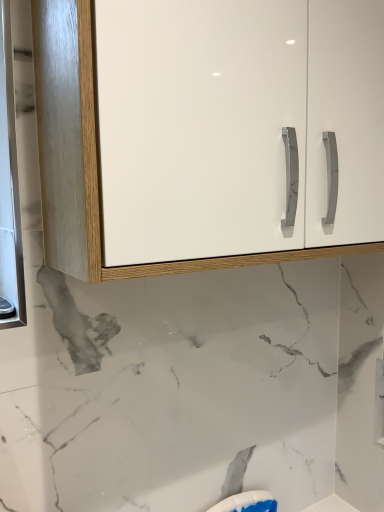
The image size is (384, 512). What are the coordinates of `white glossy medicine cabinet at left` in the screenshot? It's located at (9, 188).

In the scene shown: Measure the distance between white glossy medicine cabinet at left and camera.

white glossy medicine cabinet at left and camera are 28.22 inches apart.

Describe the element at coordinates (9, 188) in the screenshot. I see `white glossy medicine cabinet at left` at that location.

The height and width of the screenshot is (512, 384). Find the location of `white glossy cabinet at upper center`. white glossy cabinet at upper center is located at coordinates (208, 132).

This screenshot has height=512, width=384. What do you see at coordinates (208, 132) in the screenshot? I see `white glossy cabinet at upper center` at bounding box center [208, 132].

Find the location of `white glossy medicine cabinet at left`. white glossy medicine cabinet at left is located at coordinates (9, 188).

Can you confirm if white glossy medicine cabinet at left is positioned to the left of white glossy cabinet at upper center?

Correct, you'll find white glossy medicine cabinet at left to the left of white glossy cabinet at upper center.

In the image, is white glossy medicine cabinet at left positioned in front of or behind white glossy cabinet at upper center?

white glossy medicine cabinet at left is behind white glossy cabinet at upper center.

Does point (2, 263) come in front of point (138, 67)?

No, it is behind (138, 67).

From the image's perspective, is white glossy medicine cabinet at left over white glossy cabinet at upper center?

No.

From a real-world perspective, who is located higher, white glossy medicine cabinet at left or white glossy cabinet at upper center?

white glossy cabinet at upper center, from a real-world perspective.

Can you confirm if white glossy medicine cabinet at left is wider than white glossy cabinet at upper center?

In fact, white glossy medicine cabinet at left might be narrower than white glossy cabinet at upper center.

Considering the relative sizes of white glossy medicine cabinet at left and white glossy cabinet at upper center in the image provided, is white glossy medicine cabinet at left shorter than white glossy cabinet at upper center?

No.

Considering the relative sizes of white glossy medicine cabinet at left and white glossy cabinet at upper center in the image provided, is white glossy medicine cabinet at left smaller than white glossy cabinet at upper center?

Indeed, white glossy medicine cabinet at left has a smaller size compared to white glossy cabinet at upper center.

Is white glossy medicine cabinet at left surrounding white glossy cabinet at upper center?

No, white glossy cabinet at upper center is not a part of white glossy medicine cabinet at left.

Are white glossy medicine cabinet at left and white glossy cabinet at upper center beside each other?

No.

Is white glossy medicine cabinet at left facing towards white glossy cabinet at upper center?

No, white glossy medicine cabinet at left is not facing towards white glossy cabinet at upper center.

What's the angular difference between white glossy medicine cabinet at left and white glossy cabinet at upper center's facing directions?

The angle between the facing direction of white glossy medicine cabinet at left and the facing direction of white glossy cabinet at upper center is 93.5 degrees.

The width and height of the screenshot is (384, 512). What are the coordinates of `medicine cabinet on the left of white glossy cabinet at upper center` in the screenshot? It's located at click(x=9, y=188).

Which object is positioned more to the right, white glossy cabinet at upper center or white glossy medicine cabinet at left?

From the viewer's perspective, white glossy cabinet at upper center appears more on the right side.

Is white glossy cabinet at upper center positioned before white glossy medicine cabinet at left?

That is True.

Which is more distant, (115, 88) or (0, 68)?

Point (0, 68)

From the image's perspective, is white glossy cabinet at upper center located above white glossy medicine cabinet at left?

Yes, from the image's perspective, white glossy cabinet at upper center is above white glossy medicine cabinet at left.

Consider the image. From a real-world perspective, who is located lower, white glossy cabinet at upper center or white glossy medicine cabinet at left?

From a 3D spatial view, white glossy medicine cabinet at left is below.

In terms of width, does white glossy cabinet at upper center look wider or thinner when compared to white glossy medicine cabinet at left?

In the image, white glossy cabinet at upper center appears to be wider than white glossy medicine cabinet at left.

Which of these two, white glossy cabinet at upper center or white glossy medicine cabinet at left, stands taller?

Standing taller between the two is white glossy medicine cabinet at left.

Considering the relative sizes of white glossy cabinet at upper center and white glossy medicine cabinet at left in the image provided, is white glossy cabinet at upper center smaller than white glossy medicine cabinet at left?

No, white glossy cabinet at upper center is not smaller than white glossy medicine cabinet at left.

Which is correct: white glossy cabinet at upper center is inside white glossy medicine cabinet at left, or outside of it?

white glossy cabinet at upper center is not inside white glossy medicine cabinet at left, it's outside.

Is white glossy cabinet at upper center placed right next to white glossy medicine cabinet at left?

white glossy cabinet at upper center is not next to white glossy medicine cabinet at left, and they're not touching.

Is white glossy cabinet at upper center oriented towards white glossy medicine cabinet at left?

No, white glossy cabinet at upper center is not oriented towards white glossy medicine cabinet at left.

How many degrees apart are the facing directions of white glossy cabinet at upper center and white glossy medicine cabinet at left?

93.5 degrees separate the facing orientations of white glossy cabinet at upper center and white glossy medicine cabinet at left.

The width and height of the screenshot is (384, 512). I want to click on cabinetry above the white glossy medicine cabinet at left (from a real-world perspective), so click(208, 132).

Find the location of a particular element. The image size is (384, 512). cabinetry above the white glossy medicine cabinet at left (from the image's perspective) is located at coordinates (208, 132).

Identify the location of cabinetry on the right of white glossy medicine cabinet at left. The height and width of the screenshot is (512, 384). (208, 132).